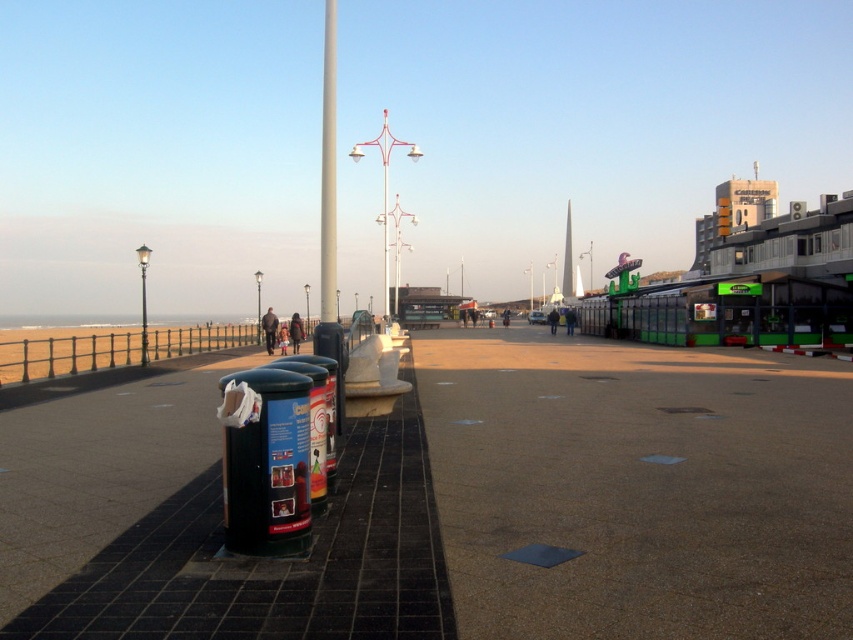
Question: Does brown textured pavement at center have a smaller size compared to metallic pole at center?

Choices:
 (A) no
 (B) yes

Answer: (B)

Question: Which of the following is the farthest from the observer?

Choices:
 (A) (x=810, y=628)
 (B) (x=335, y=291)

Answer: (B)

Question: Is brown textured pavement at center positioned in front of metallic pole at center?

Choices:
 (A) no
 (B) yes

Answer: (B)

Question: Among these objects, which one is farthest from the camera?

Choices:
 (A) brown textured pavement at center
 (B) metallic pole at center

Answer: (B)

Question: Is the position of brown textured pavement at center less distant than that of metallic pole at center?

Choices:
 (A) yes
 (B) no

Answer: (A)

Question: Which point is farther to the camera?

Choices:
 (A) (611, 509)
 (B) (332, 125)

Answer: (B)